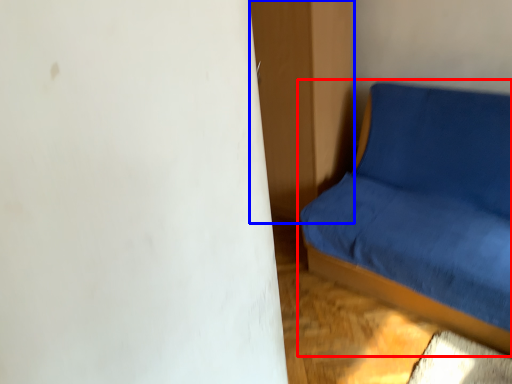
Question: Which object appears closest to the camera in this image, studio couch (highlighted by a red box) or dresser (highlighted by a blue box)?

Choices:
 (A) studio couch
 (B) dresser

Answer: (A)